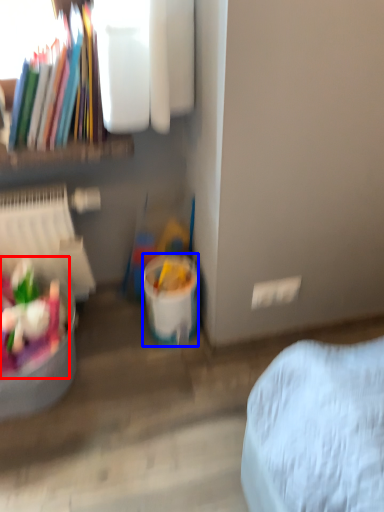
Question: Which point is further to the camera, food (highlighted by a red box) or bucket (highlighted by a blue box)?

Choices:
 (A) food
 (B) bucket

Answer: (B)